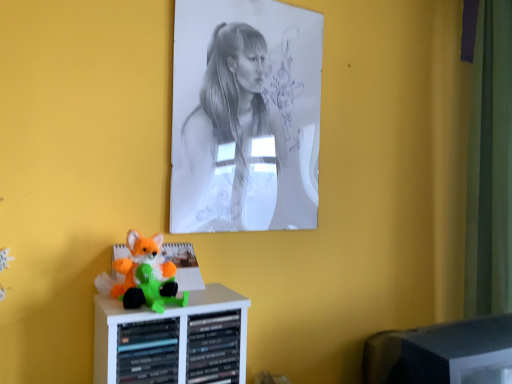
The image size is (512, 384). What do you see at coordinates (146, 275) in the screenshot? I see `fluffy plush toy at lower left` at bounding box center [146, 275].

What do you see at coordinates (442, 353) in the screenshot? I see `black plastic monitor at lower right` at bounding box center [442, 353].

What is the approximate width of graphite paper portrait at upper center?

graphite paper portrait at upper center is 1.52 inches wide.

Locate an element on the screen. fluffy plush toy at lower left is located at coordinates (146, 275).

Considering the relative sizes of black plastic monitor at lower right and graphite paper portrait at upper center in the image provided, is black plastic monitor at lower right shorter than graphite paper portrait at upper center?

Correct, black plastic monitor at lower right is not as tall as graphite paper portrait at upper center.

Is black plastic monitor at lower right positioned with its back to graphite paper portrait at upper center?

black plastic monitor at lower right does not have its back to graphite paper portrait at upper center.

Is black plastic monitor at lower right next to graphite paper portrait at upper center?

They are not placed beside each other.

Consider the image. Can you confirm if black plastic monitor at lower right is positioned to the right of graphite paper portrait at upper center?

Correct, you'll find black plastic monitor at lower right to the right of graphite paper portrait at upper center.

Considering the sizes of graphite paper portrait at upper center and black plastic monitor at lower right in the image, is graphite paper portrait at upper center bigger or smaller than black plastic monitor at lower right?

In the image, graphite paper portrait at upper center appears to be smaller than black plastic monitor at lower right.

In the image, is graphite paper portrait at upper center positioned in front of or behind black plastic monitor at lower right?

Visually, graphite paper portrait at upper center is located behind black plastic monitor at lower right.

Could you tell me if graphite paper portrait at upper center is turned towards black plastic monitor at lower right?

No, graphite paper portrait at upper center is not oriented towards black plastic monitor at lower right.

Would you say graphite paper portrait at upper center is outside black plastic monitor at lower right?

A: Absolutely, graphite paper portrait at upper center is external to black plastic monitor at lower right.

From the image's perspective, is fluffy plush toy at lower left over graphite paper portrait at upper center?

No, from the image's perspective, fluffy plush toy at lower left is not above graphite paper portrait at upper center.

Is fluffy plush toy at lower left positioned far away from graphite paper portrait at upper center?

No, there isn't a large distance between fluffy plush toy at lower left and graphite paper portrait at upper center.

You are a GUI agent. You are given a task and a screenshot of the screen. Output one action in this format:
    pyautogui.click(x=<x>, y=<y>)
    Task: Click on the toy on the left side of graphite paper portrait at upper center
    This screenshot has width=512, height=384.
    Given the screenshot: What is the action you would take?
    pyautogui.click(x=146, y=275)

Are fluffy plush toy at lower left and black plastic monitor at lower right beside each other?

There is a gap between fluffy plush toy at lower left and black plastic monitor at lower right.

The width and height of the screenshot is (512, 384). I want to click on computer monitor on the right of the fluffy plush toy at lower left, so click(442, 353).

How distant is fluffy plush toy at lower left from black plastic monitor at lower right?

A distance of 66.02 centimeters exists between fluffy plush toy at lower left and black plastic monitor at lower right.

From the image's perspective, which object appears higher, fluffy plush toy at lower left or black plastic monitor at lower right?

From the image's view, fluffy plush toy at lower left is above.

Do you think graphite paper portrait at upper center is within fluffy plush toy at lower left, or outside of it?

graphite paper portrait at upper center exists outside the volume of fluffy plush toy at lower left.

From a real-world perspective, is graphite paper portrait at upper center over fluffy plush toy at lower left?

Indeed, from a real-world perspective, graphite paper portrait at upper center stands above fluffy plush toy at lower left.

Locate an element on the screen. Image resolution: width=512 pixels, height=384 pixels. person located on the right of fluffy plush toy at lower left is located at coordinates (240, 148).

From the image's perspective, is black plastic monitor at lower right located above or below fluffy plush toy at lower left?

From the image's perspective, black plastic monitor at lower right appears below fluffy plush toy at lower left.

From the picture: Can you see black plastic monitor at lower right touching fluffy plush toy at lower left?

black plastic monitor at lower right and fluffy plush toy at lower left are not in contact.

Does black plastic monitor at lower right turn towards fluffy plush toy at lower left?

No, black plastic monitor at lower right is not oriented towards fluffy plush toy at lower left.

Choose the correct answer: Is black plastic monitor at lower right inside fluffy plush toy at lower left or outside it?

black plastic monitor at lower right is spatially situated outside fluffy plush toy at lower left.

The image size is (512, 384). I want to click on computer monitor that is in front of the graphite paper portrait at upper center, so click(x=442, y=353).

Locate an element on the screen. The image size is (512, 384). person behind the black plastic monitor at lower right is located at coordinates (240, 148).

When comparing their distances from black plastic monitor at lower right, does graphite paper portrait at upper center or fluffy plush toy at lower left seem further?

fluffy plush toy at lower left.

Considering their positions, is fluffy plush toy at lower left positioned further to graphite paper portrait at upper center than black plastic monitor at lower right?

black plastic monitor at lower right lies further to graphite paper portrait at upper center than the other object.

Which object lies further to the anchor point black plastic monitor at lower right, fluffy plush toy at lower left or graphite paper portrait at upper center?

fluffy plush toy at lower left is further to black plastic monitor at lower right.

Estimate the real-world distances between objects in this image. Which object is closer to fluffy plush toy at lower left, graphite paper portrait at upper center or black plastic monitor at lower right?

graphite paper portrait at upper center.

Looking at the image, which one is located further to fluffy plush toy at lower left, black plastic monitor at lower right or graphite paper portrait at upper center?

black plastic monitor at lower right.

From the image, which object appears to be farther from graphite paper portrait at upper center, black plastic monitor at lower right or fluffy plush toy at lower left?

The object further to graphite paper portrait at upper center is black plastic monitor at lower right.

At what (x,y) coordinates should I click in order to perform the action: click on person between fluffy plush toy at lower left and black plastic monitor at lower right from left to right. Please return your answer as a coordinate pair (x, y). The image size is (512, 384). Looking at the image, I should click on (240, 148).